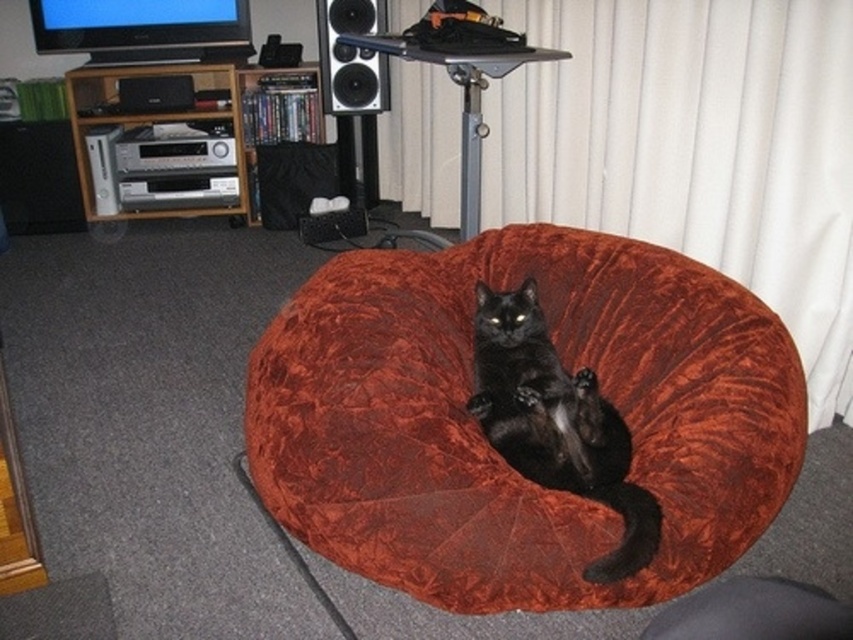
Looking at this image, does black velvet cat at center have a lesser height compared to black fabric speaker at center?

Incorrect, black velvet cat at center's height does not fall short of black fabric speaker at center's.

Who is positioned more to the left, black velvet cat at center or black fabric speaker at center?

black fabric speaker at center is more to the left.

This screenshot has width=853, height=640. In order to click on black velvet cat at center in this screenshot , I will do `click(556, 422)`.

Does velvet orange bean bag chair at center appear under black velvet cat at center?

No.

Is velvet orange bean bag chair at center shorter than black velvet cat at center?

No, velvet orange bean bag chair at center is not shorter than black velvet cat at center.

The image size is (853, 640). Describe the element at coordinates (486, 442) in the screenshot. I see `velvet orange bean bag chair at center` at that location.

Locate an element on the screen. The width and height of the screenshot is (853, 640). velvet orange bean bag chair at center is located at coordinates (486, 442).

Does black velvet cat at center lie in front of wooden entertainment center at left?

Yes, it is.

Is point (607, 493) positioned behind point (186, 209)?

No, it is not.

Where is `black velvet cat at center`? The height and width of the screenshot is (640, 853). black velvet cat at center is located at coordinates (556, 422).